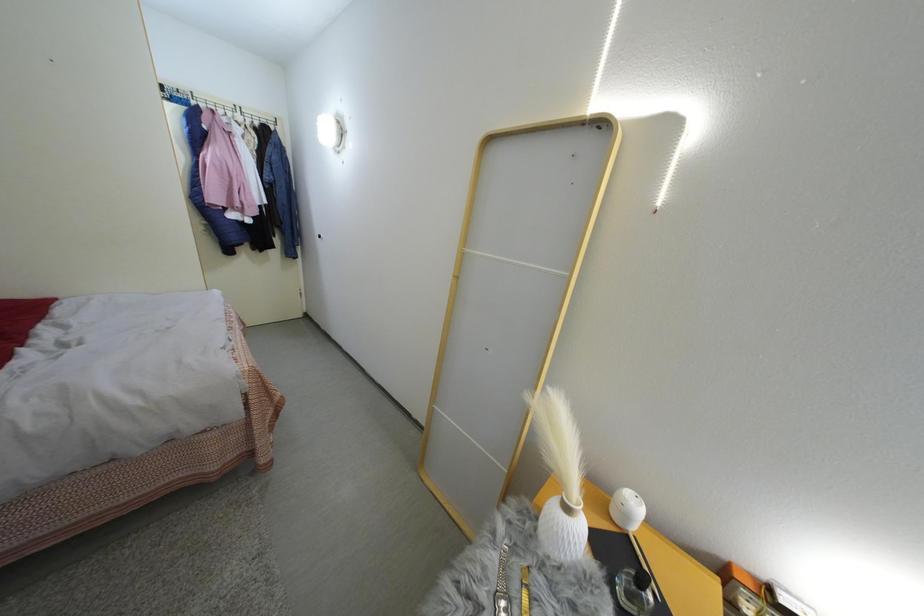
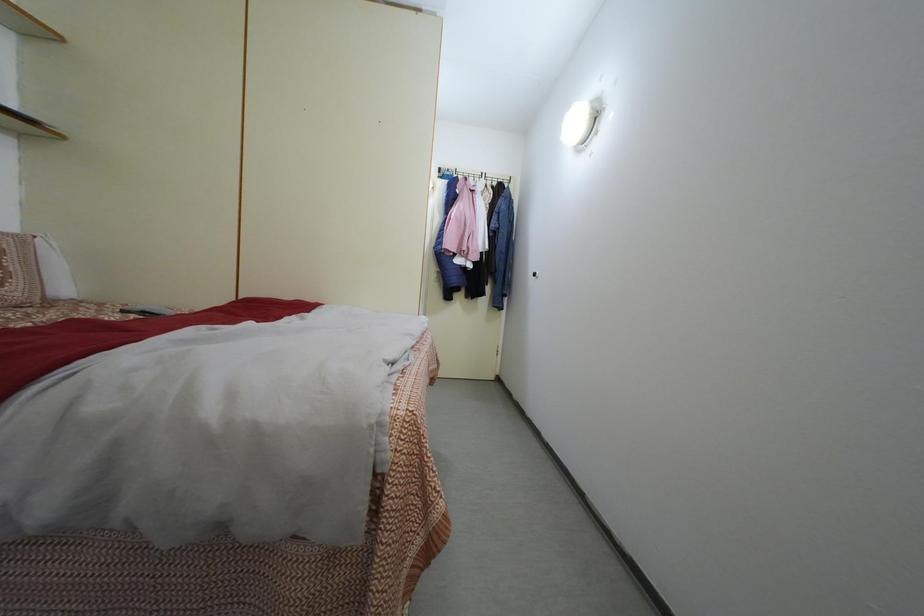
The images are taken continuously from a first-person perspective. In which direction is your viewpoint rotating?

The camera's rotation is toward left-up.